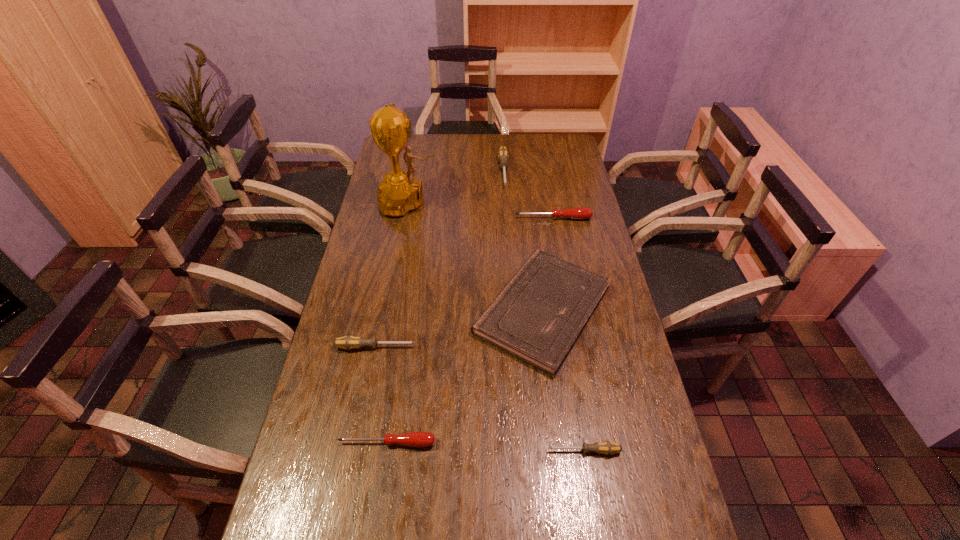
Locate an element on the screen. The image size is (960, 540). the left red screwdriver is located at coordinates (419, 439).

Locate an element on the screen. the rightmost gray screwdriver is located at coordinates (607, 447).

You are a GUI agent. You are given a task and a screenshot of the screen. Output one action in this format:
    pyautogui.click(x=<x>, y=<y>)
    Task: Click on the shortest object
    
    Given the screenshot: What is the action you would take?
    pyautogui.click(x=607, y=447)

The width and height of the screenshot is (960, 540). What are the coordinates of `free space located on the front side of the tallest object` in the screenshot? It's located at (497, 202).

In order to click on vacant region located at the tip of the farthest screwdriver in this screenshot , I will do (506, 206).

At what (x,y) coordinates should I click in order to perform the action: click on vacant area situated on the front of the right red screwdriver. Please return your answer as a coordinate pair (x, y). Looking at the image, I should click on (563, 274).

The height and width of the screenshot is (540, 960). In order to click on free space located at the tip of the second farthest gray screwdriver in this screenshot , I will do `click(506, 347)`.

This screenshot has width=960, height=540. I want to click on free space located 0.050m on the front of the paperback book, so click(554, 394).

Find the location of a particular element. free space located 0.380m on the back of the nearer red screwdriver is located at coordinates (406, 317).

I want to click on free space located at the tip of the nearest gray screwdriver, so click(399, 451).